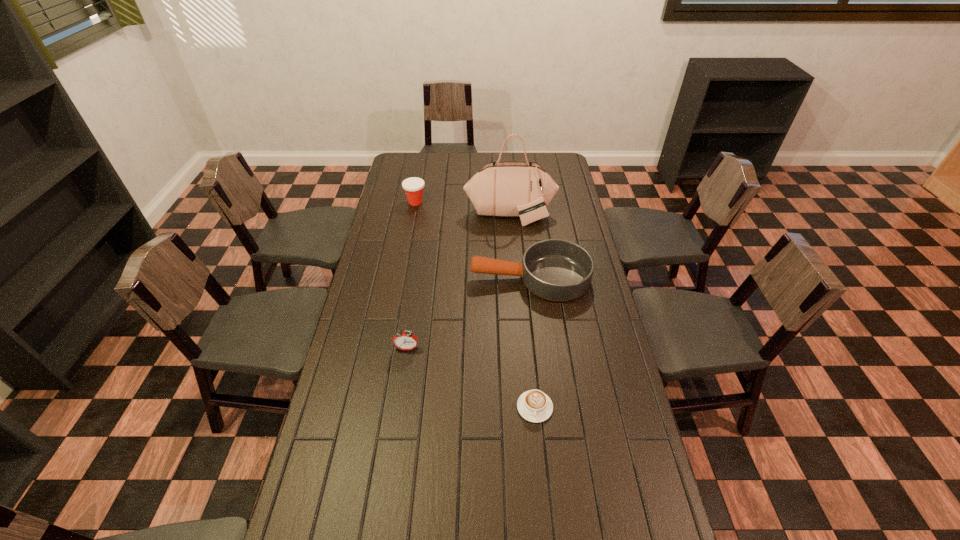
Locate an element on the screen. object that is the fourth closest to the pan is located at coordinates (413, 186).

The width and height of the screenshot is (960, 540). Identify the location of object that can be found as the third closest to the third nearest object. click(534, 406).

Find the location of a particular element. vacant region that satisfies the following two spatial constraints: 1. on the handle side of the pan; 2. on the clock face of the alarm clock is located at coordinates (539, 348).

This screenshot has height=540, width=960. Identify the location of vacant space that satisfies the following two spatial constraints: 1. on the handle side of the pan; 2. on the clock face of the alarm clock. (539, 348).